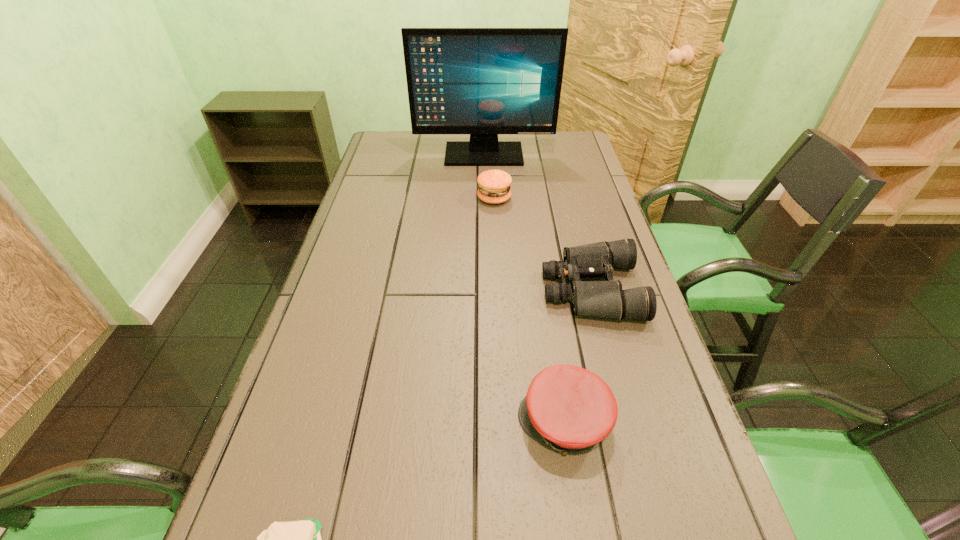
You are a GUI agent. You are given a task and a screenshot of the screen. Output one action in this format:
    pyautogui.click(x=<x>, y=<y>)
    Task: Click on the object that stands as the second closest to the fourth nearest object
    
    Given the screenshot: What is the action you would take?
    pyautogui.click(x=606, y=299)

You are a GUI agent. You are given a task and a screenshot of the screen. Output one action in this format:
    pyautogui.click(x=<x>, y=<y>)
    Task: Click on the blank space that satisfies the following two spatial constraints: 1. on the screen side of the taller patty; 2. on the right side of the tallest object
    
    Given the screenshot: What is the action you would take?
    pyautogui.click(x=485, y=198)